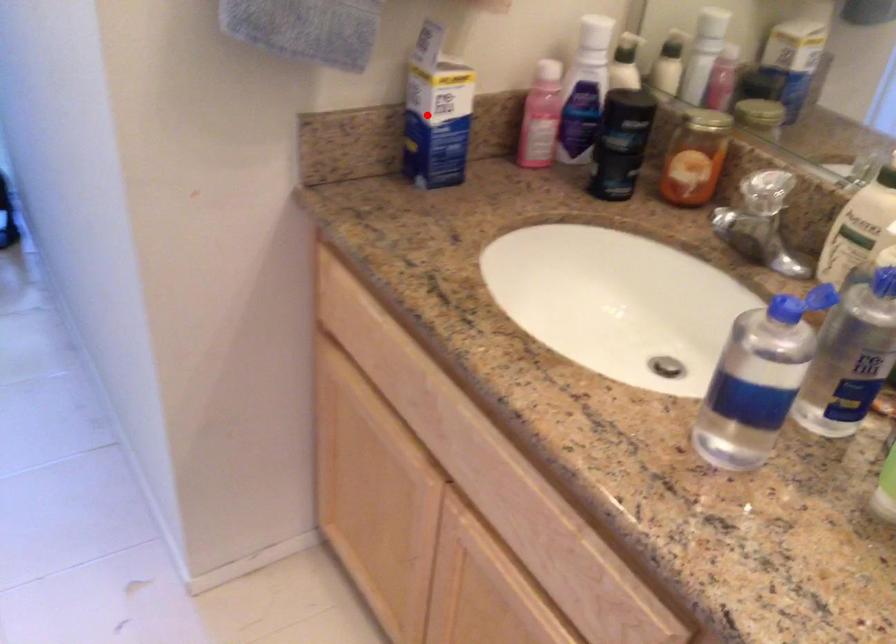
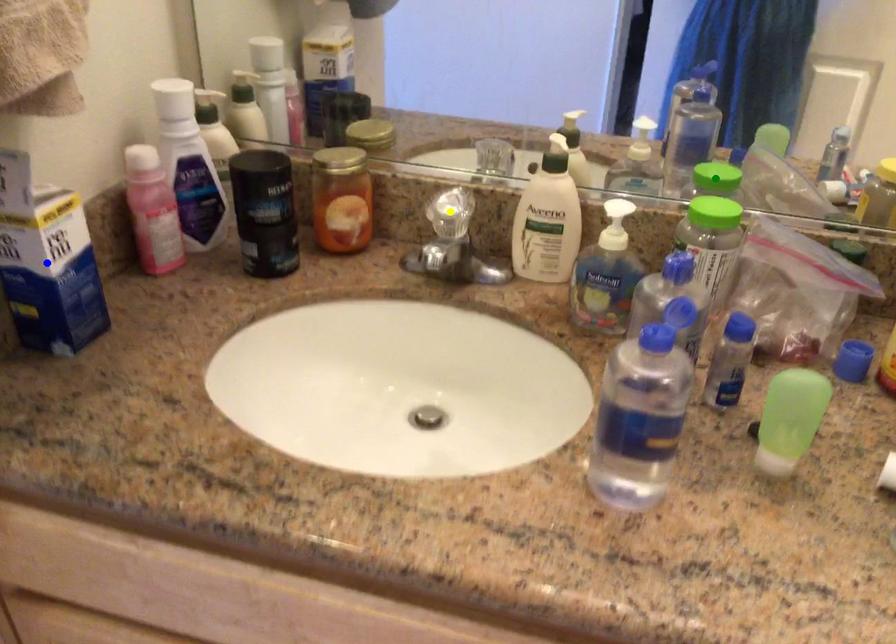
Question: I am providing you with two images of the same scene from different viewpoints. A red point is marked on the first image. You are given multiple points on the second image. Which mark in image 2 goes with the point in image 1?

Choices:
 (A) blue point
 (B) yellow point
 (C) green point

Answer: (A)